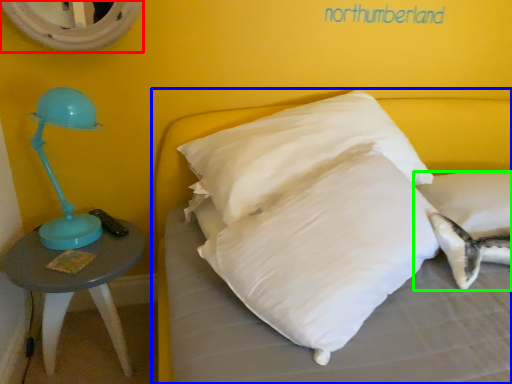
Question: Which object is positioned farthest from mirror (highlighted by a red box)? Select from bed (highlighted by a blue box) and pillow (highlighted by a green box).

Choices:
 (A) bed
 (B) pillow

Answer: (B)